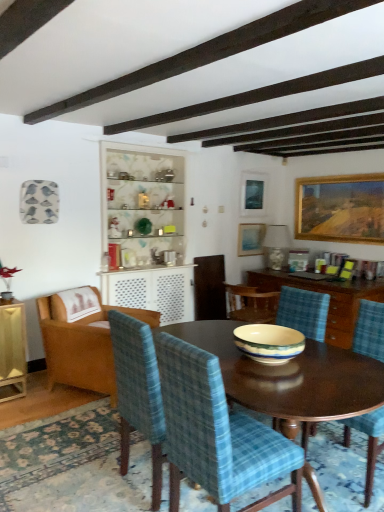
This screenshot has height=512, width=384. Identify the location of vacant region to the right of porcelain bowl at center. (334, 362).